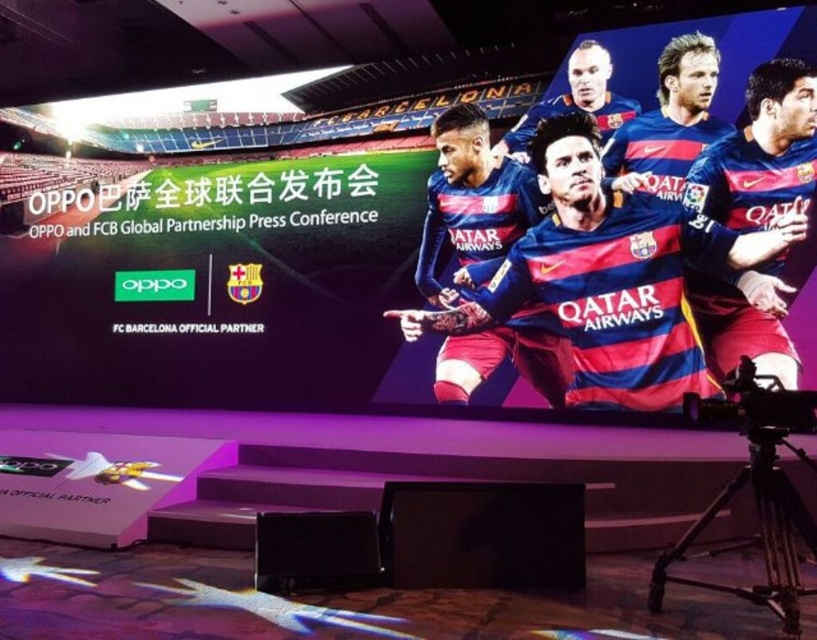
You are an event photographer positioned at the front of the stage. You need to capture both the blue fabric jersey at upper center and the blue jersey at upper right in a single frame. Based on their positions, which jersey should you adjust your camera to focus on first to ensure both are in the shot?

The blue fabric jersey at upper center is to the left of the blue jersey at upper right. To capture both in a single frame, you should focus on the blue fabric jersey at upper center first, as it is positioned to the left, ensuring the camera can encompass both from left to right.

You are a photographer at the event and need to capture both the blue fabric jersey at upper center and the blue striped jersey at upper right in a single frame. Which jersey should you focus on first to ensure both are in the frame without moving the camera?

You should focus on the blue striped jersey at upper right first because it is wider than the blue fabric jersey at upper center, so positioning the camera to include the wider jersey ensures the thinner one will also fit within the frame.